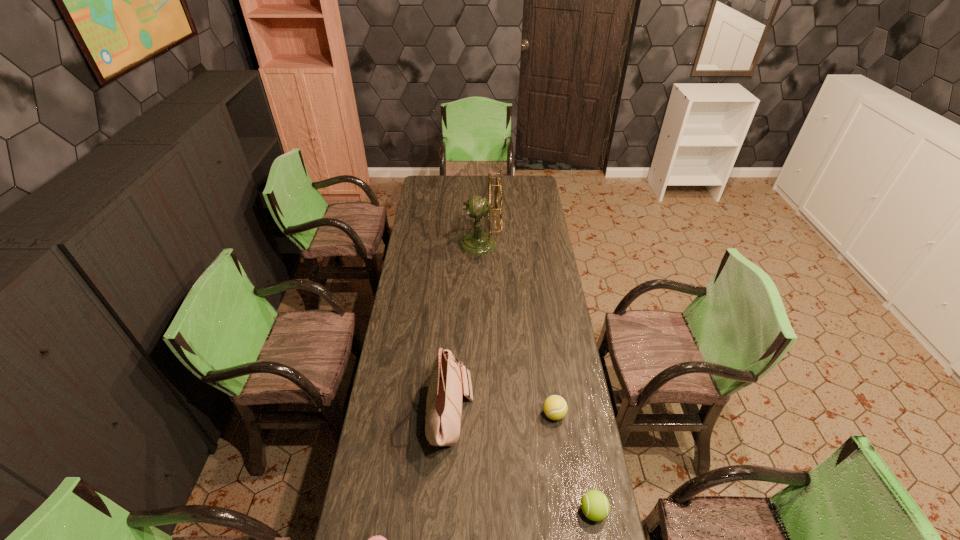
You are a GUI agent. You are given a task and a screenshot of the screen. Output one action in this format:
    pyautogui.click(x=<x>, y=<y>)
    Task: Click on the free spot at the right edge of the desktop
    The width and height of the screenshot is (960, 540).
    Given the screenshot: What is the action you would take?
    pyautogui.click(x=520, y=218)

This screenshot has width=960, height=540. I want to click on free spot at the far left corner of the desktop, so (x=434, y=189).

Locate an element on the screen. vacant space at the far right corner of the desktop is located at coordinates (524, 184).

The height and width of the screenshot is (540, 960). Identify the location of vacant region between the handbag and the farthest object. (466, 328).

Where is `vacant point located between the farther tennis ball and the fan`? vacant point located between the farther tennis ball and the fan is located at coordinates (517, 329).

The height and width of the screenshot is (540, 960). I want to click on free space between the fan and the handbag, so click(x=466, y=328).

Where is `empty space between the handbag and the farthest object`? empty space between the handbag and the farthest object is located at coordinates (466, 328).

You are a GUI agent. You are given a task and a screenshot of the screen. Output one action in this format:
    pyautogui.click(x=<x>, y=<y>)
    Task: Click on the vacant space that's between the fourth farthest object and the farther tennis ball
    The height and width of the screenshot is (540, 960).
    Given the screenshot: What is the action you would take?
    pyautogui.click(x=573, y=463)

Where is `free space between the nearer tennis ball and the handbag`? The height and width of the screenshot is (540, 960). free space between the nearer tennis ball and the handbag is located at coordinates (522, 462).

Identify which object is located as the fourth nearest to the farthest object. Please provide its 2D coordinates. Your answer should be formatted as a tuple, i.e. [(x, y)], where the tuple contains the x and y coordinates of a point satisfying the conditions above.

[(378, 539)]